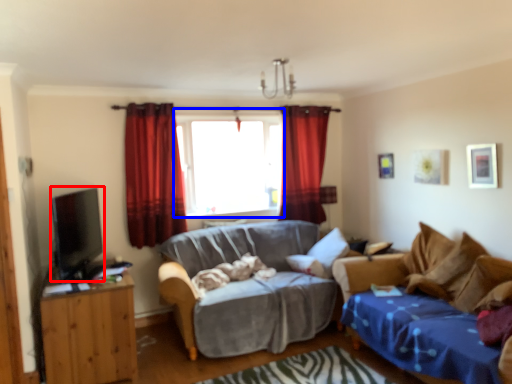
Question: Which of the following is the farthest to the observer, open (highlighted by a red box) or window (highlighted by a blue box)?

Choices:
 (A) open
 (B) window

Answer: (B)